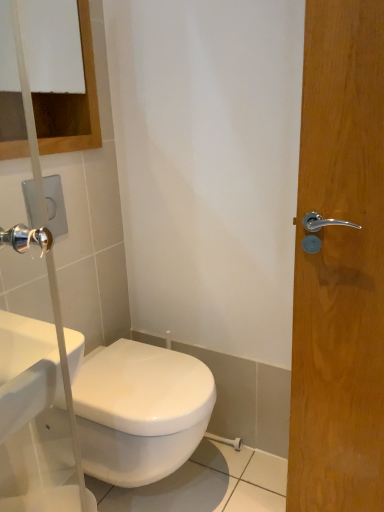
Describe the element at coordinates (140, 411) in the screenshot. This screenshot has height=512, width=384. I see `white glossy toilet at lower center` at that location.

The height and width of the screenshot is (512, 384). In order to click on white glossy toilet at lower center in this screenshot , I will do `click(140, 411)`.

Find the location of a particular element. white glossy toilet at lower center is located at coordinates (140, 411).